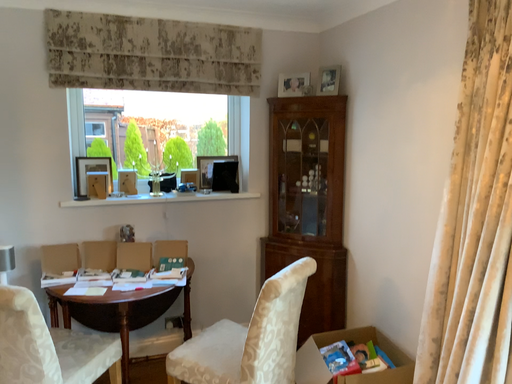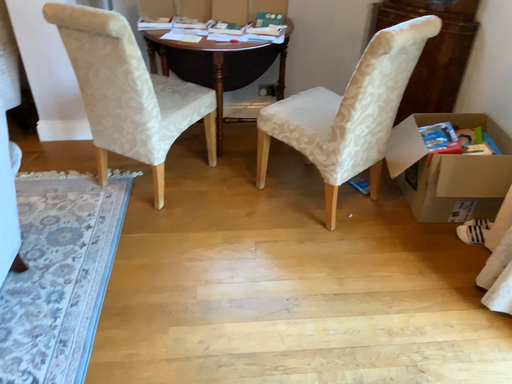
Question: Which way did the camera rotate in the video?

Choices:
 (A) rotated right
 (B) rotated left

Answer: (B)